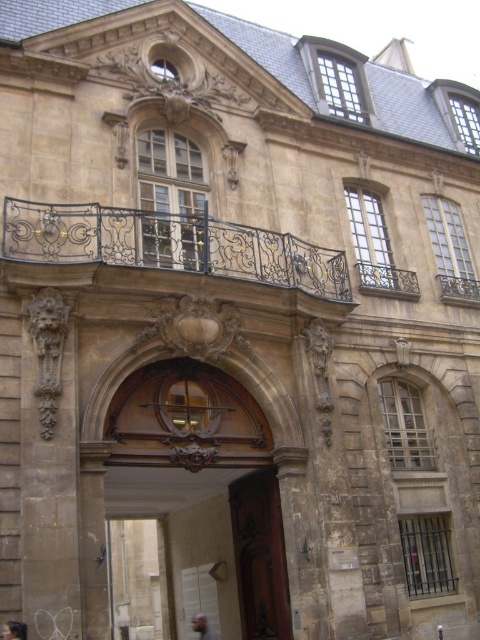
You are an architect assessing the symmetry of the classical building. The building has a brown polished wood door at center and a gray hair at center. Which object has a greater width?

The brown polished wood door at center has a greater width than the gray hair at center.

You are standing in front of the classical building and notice two people in the scene. One has dark brown hair at lower left and the other has gray hair at center. Which person is closer to you?

The dark brown hair at lower left is closer to you because it is in front of the gray hair at center.

You are standing in front of the classical building and notice two points marked on its facade. The first point is at coordinate point (142, 212) and the second is at point (196, 621). Which point is closer to you?

Point (142, 212) is closer to the viewer than point (196, 621).